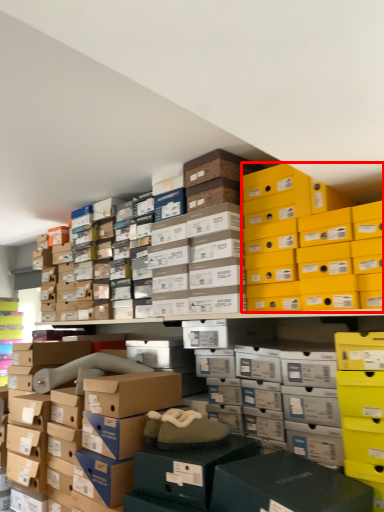
Question: From the image's perspective, what is the correct spatial relationship of storage box (annotated by the red box) in relation to storage box?

Choices:
 (A) below
 (B) above

Answer: (B)